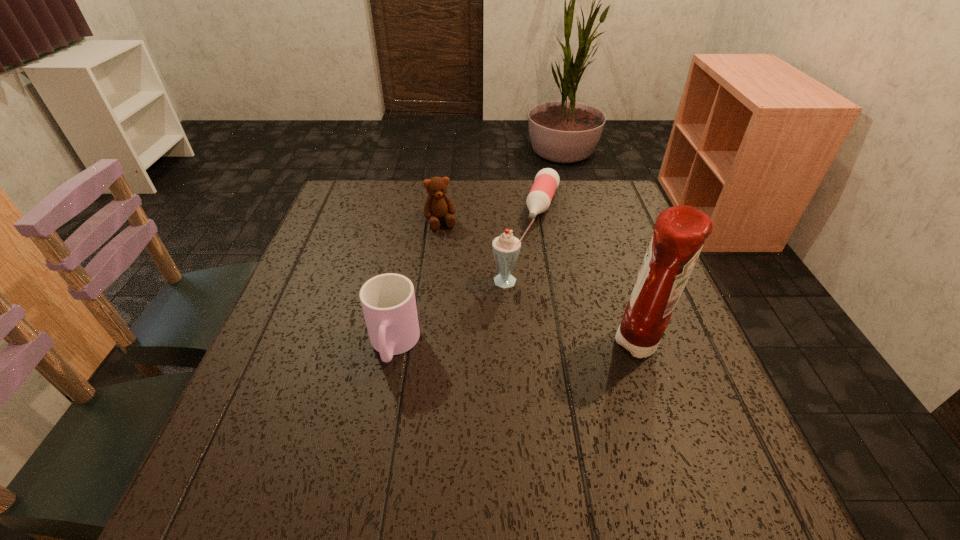
Where is `vacant spot on the desktop that is between the cup and the rightmost object and is positioned with the cap open on the second object from right to left`? vacant spot on the desktop that is between the cup and the rightmost object and is positioned with the cap open on the second object from right to left is located at coordinates (486, 346).

Identify the location of free space on the desktop that is between the cup and the rightmost object and is positioned on the face of the teddy bear. The height and width of the screenshot is (540, 960). tap(485, 346).

The image size is (960, 540). Find the location of `vacant space on the desktop that is between the cup and the rightmost object and is positioned on the straw side of the milkshake`. vacant space on the desktop that is between the cup and the rightmost object and is positioned on the straw side of the milkshake is located at coordinates (488, 346).